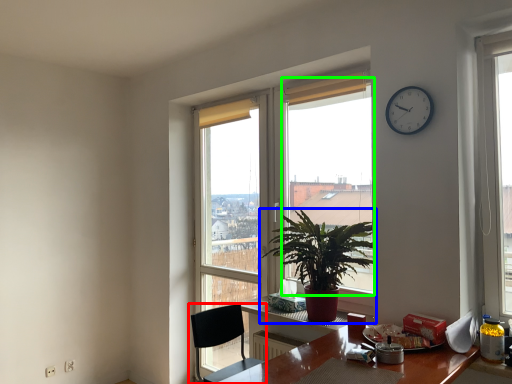
Question: Estimate the real-world distances between objects in this image. Which object is farther from chair (highlighted by a red box), houseplant (highlighted by a blue box) or window screen (highlighted by a green box)?

Choices:
 (A) houseplant
 (B) window screen

Answer: (B)